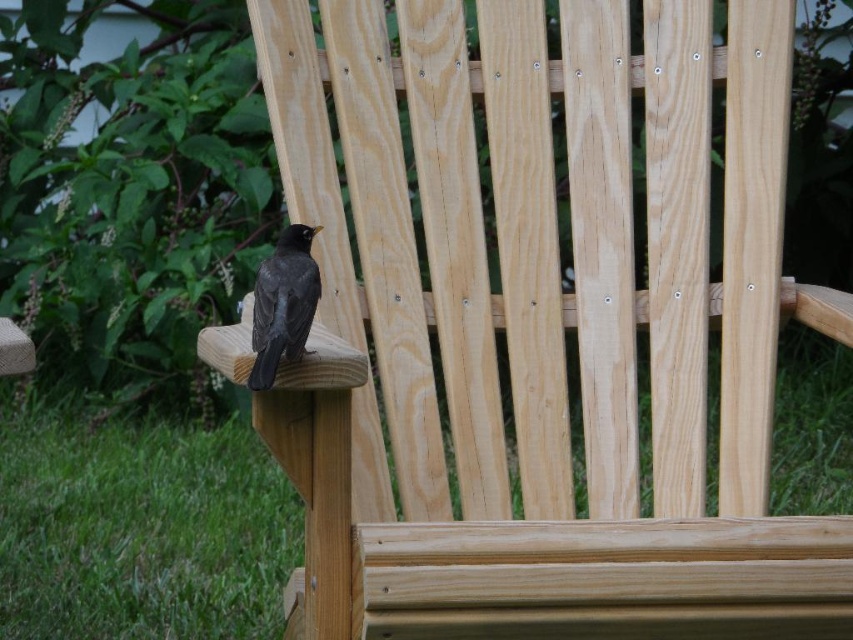
Question: Which object appears closest to the camera in this image?

Choices:
 (A) green grass at lower left
 (B) shiny black bird at left

Answer: (B)

Question: Is green grass at lower left to the left of shiny black bird at left from the viewer's perspective?

Choices:
 (A) yes
 (B) no

Answer: (B)

Question: Does green grass at lower left lie in front of shiny black bird at left?

Choices:
 (A) no
 (B) yes

Answer: (A)

Question: Among these objects, which one is farthest from the camera?

Choices:
 (A) shiny black bird at left
 (B) green grass at lower left

Answer: (B)

Question: Is green grass at lower left wider than shiny black bird at left?

Choices:
 (A) no
 (B) yes

Answer: (B)